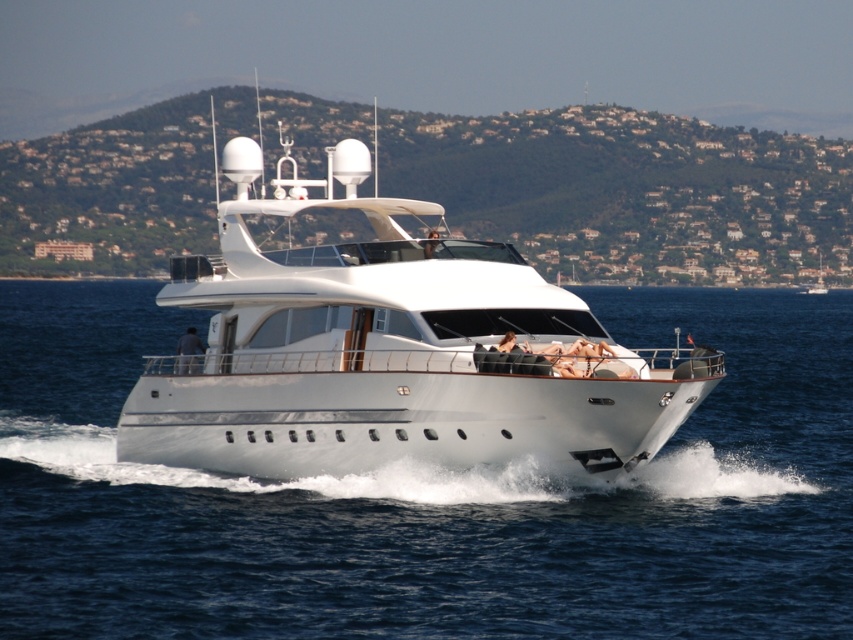
Does point (106, 516) come farther from viewer compared to point (514, 355)?

Yes, it is behind point (514, 355).

Can you confirm if white glossy water at center is shorter than white glossy yacht at center?

Indeed, white glossy water at center has a lesser height compared to white glossy yacht at center.

Who is more forward, (x=722, y=586) or (x=399, y=355)?

Point (x=722, y=586)

Where is `white glossy water at center`? Image resolution: width=853 pixels, height=640 pixels. white glossy water at center is located at coordinates (431, 499).